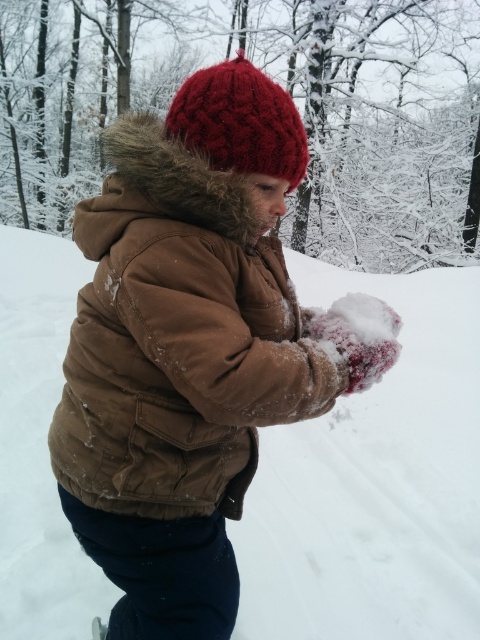
Is point (112, 324) farther from viewer compared to point (256, 70)?

No, (112, 324) is in front of (256, 70).

Between brown cotton jacket at center and knitted red hat at upper center, which one is positioned higher?

knitted red hat at upper center is above.

Is point (84, 410) farther from viewer compared to point (238, 68)?

Yes, it is.

Identify the location of brown cotton jacket at center. (179, 337).

Looking at this image, is white fluffy snow at center taller than knitted red hat at upper center?

Indeed, white fluffy snow at center has a greater height compared to knitted red hat at upper center.

Can you confirm if white fluffy snow at center is positioned to the right of knitted red hat at upper center?

Indeed, white fluffy snow at center is positioned on the right side of knitted red hat at upper center.

Is point (444, 472) farther from camera compared to point (232, 128)?

That is True.

Locate an element on the screen. This screenshot has height=640, width=480. white fluffy snow at center is located at coordinates (x=373, y=483).

How distant is white fluffy snow at center from brown cotton jacket at center?

The distance of white fluffy snow at center from brown cotton jacket at center is 3.25 meters.

Identify the location of white fluffy snow at center. (373, 483).

The height and width of the screenshot is (640, 480). Find the location of `white fluffy snow at center`. white fluffy snow at center is located at coordinates (373, 483).